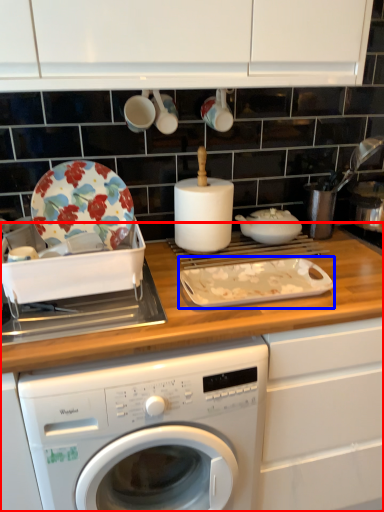
Question: Which object is closer to the camera taking this photo, countertop (highlighted by a red box) or baking sheet (highlighted by a blue box)?

Choices:
 (A) countertop
 (B) baking sheet

Answer: (A)